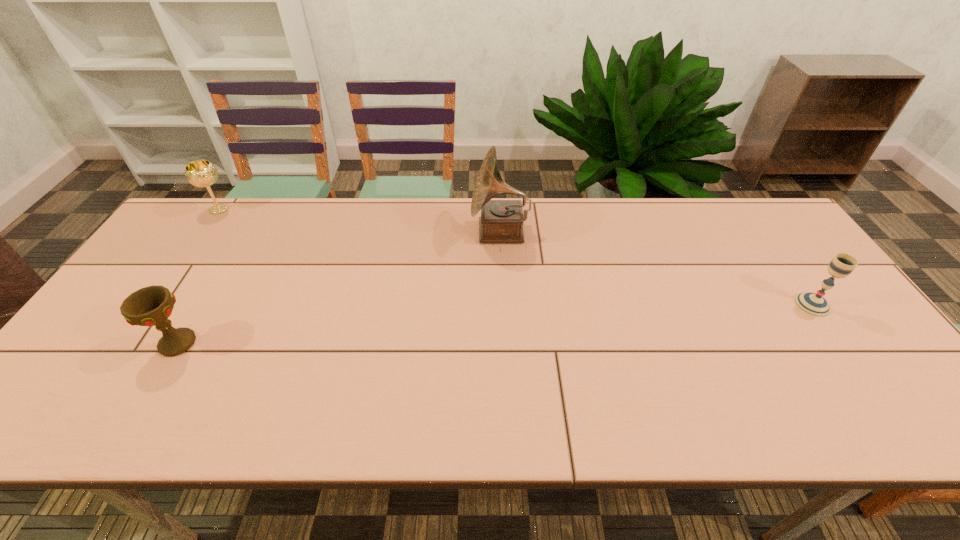
What are the coordinates of `vacant space located on the horn of the phonograph record` in the screenshot? It's located at (417, 232).

The image size is (960, 540). I want to click on free space located 0.130m on the right of the farthest chalice, so click(x=272, y=210).

This screenshot has height=540, width=960. I want to click on free region located 0.290m on the left of the third farthest object, so click(x=685, y=305).

This screenshot has width=960, height=540. Identify the location of vacant space located 0.090m on the front of the second object from left to right. (x=147, y=395).

You are a GUI agent. You are given a task and a screenshot of the screen. Output one action in this format:
    pyautogui.click(x=<x>, y=<y>)
    Task: Click on the phonograph record that is at the far edge
    
    Given the screenshot: What is the action you would take?
    pyautogui.click(x=501, y=221)

At what (x,y) coordinates should I click in order to perform the action: click on chalice situated at the far edge. Please return your answer as a coordinate pair (x, y). Looking at the image, I should click on tap(201, 173).

Find the location of a particular element. Image resolution: width=960 pixels, height=540 pixels. object present at the left edge is located at coordinates (201, 173).

The height and width of the screenshot is (540, 960). I want to click on object present at the right edge, so click(x=813, y=304).

Identify the location of object that is positioned at the far left corner. Image resolution: width=960 pixels, height=540 pixels. (201, 173).

The height and width of the screenshot is (540, 960). What are the coordinates of `free location at the far edge of the desktop` in the screenshot? It's located at coord(568,198).